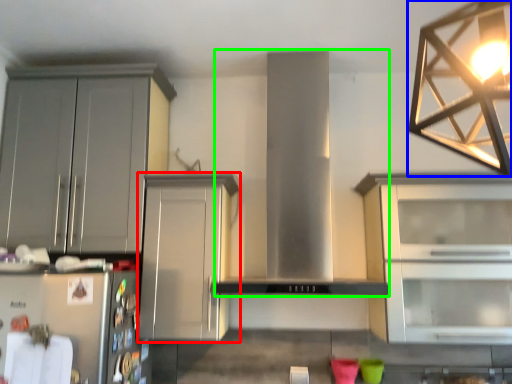
Question: Considering the real-world distances, which object is farthest from cabinetry (highlighted by a red box)? lamp (highlighted by a blue box) or hood (highlighted by a green box)?

Choices:
 (A) lamp
 (B) hood

Answer: (A)